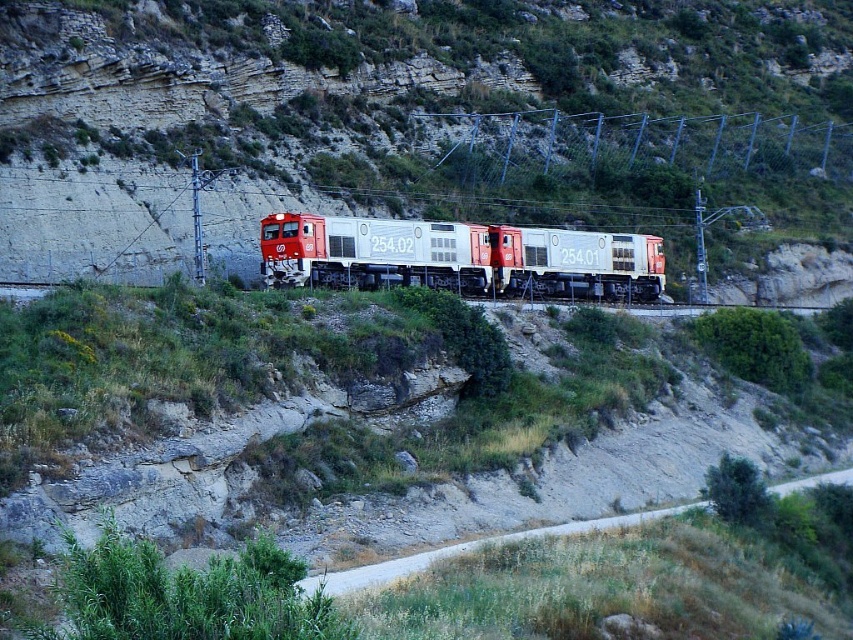
You are a maintenance worker needing to reach the dirt road at lower right from the red and white locomotive at center. What is the shortest distance you must travel?

The shortest distance you must travel is 20.23 meters between the red and white locomotive at center and the dirt road at lower right.

You are a passenger on the train and want to know which part of the train you are currently on. Based on the scene, can you determine whether you are on the matte white train at center or the silver metallic locomotive at center?

The matte white train at center is located above the silver metallic locomotive at center, so if you are on the upper part of the train, you are on the matte white train at center. If you are on the lower part, you are on the silver metallic locomotive at center.